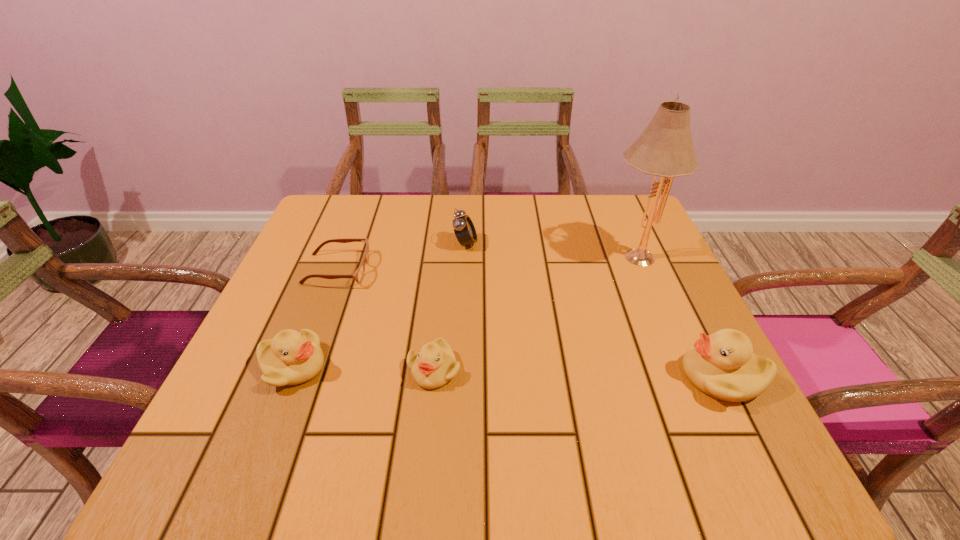
The height and width of the screenshot is (540, 960). What are the coordinates of `free space located at the face of the rightmost duckling` in the screenshot? It's located at (532, 376).

Where is `vacant space located at the face of the rightmost duckling`? The width and height of the screenshot is (960, 540). vacant space located at the face of the rightmost duckling is located at coordinates [532, 376].

Identify the location of vacant space located on the front-facing side of the shortest object. (523, 269).

Locate an element on the screen. The width and height of the screenshot is (960, 540). vacant area located on the left of the lampshade is located at coordinates (547, 254).

Where is `free space located 0.110m on the face of the alarm clock`? The height and width of the screenshot is (540, 960). free space located 0.110m on the face of the alarm clock is located at coordinates (520, 244).

Image resolution: width=960 pixels, height=540 pixels. What are the coordinates of `lampshade present at the far edge` in the screenshot? It's located at (665, 148).

This screenshot has height=540, width=960. What are the coordinates of `alarm clock at the far edge` in the screenshot? It's located at coord(464,229).

Find the location of a particular element. This screenshot has height=540, width=960. duckling at the left edge is located at coordinates (291, 358).

This screenshot has height=540, width=960. I want to click on spectacles located at the left edge, so click(x=358, y=275).

In order to click on duckling present at the right edge in this screenshot , I will do `click(722, 365)`.